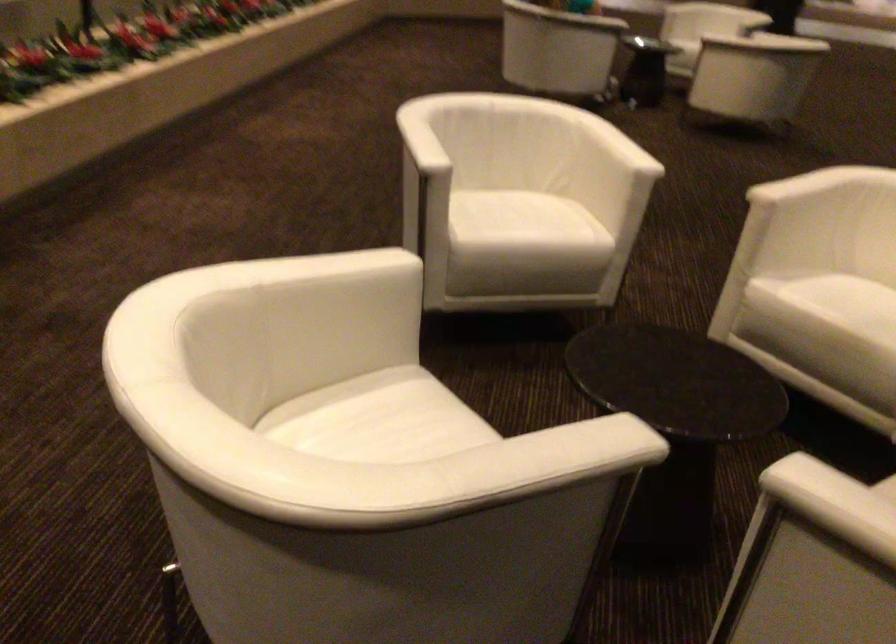
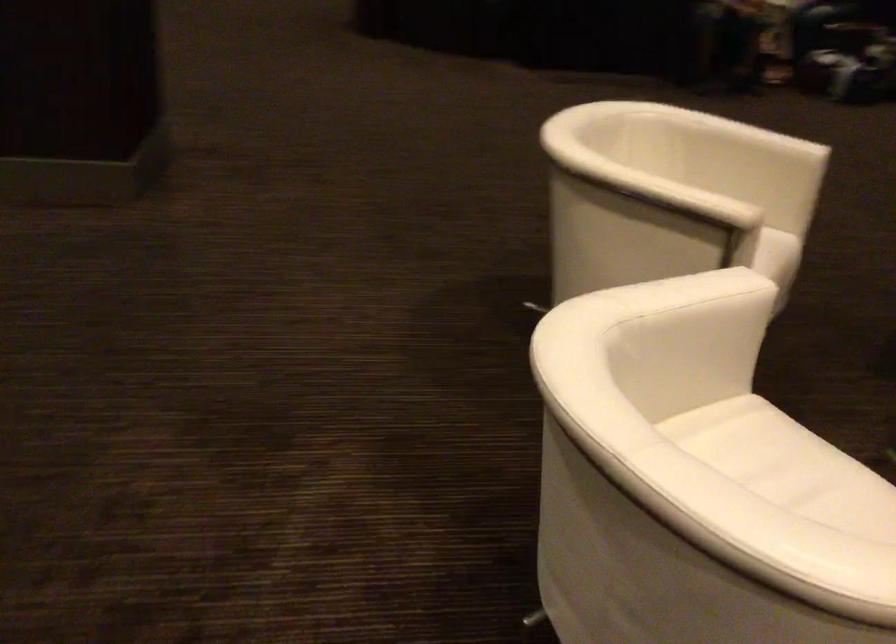
The point at (788, 181) is marked in the first image. Where is the corresponding point in the second image?

(675, 194)